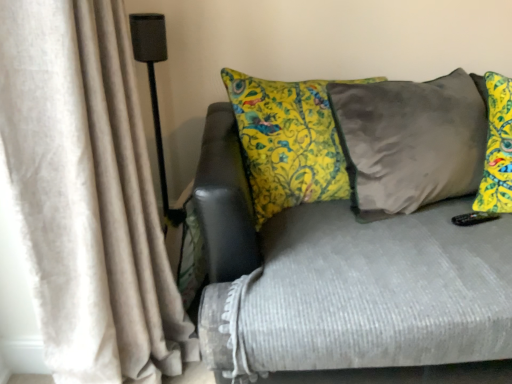
Question: Is beige velvet curtain at left closer to the viewer compared to textured gray couch at center?

Choices:
 (A) yes
 (B) no

Answer: (A)

Question: Is beige velvet curtain at left facing towards textured gray couch at center?

Choices:
 (A) yes
 (B) no

Answer: (A)

Question: Can you see beige velvet curtain at left touching textured gray couch at center?

Choices:
 (A) yes
 (B) no

Answer: (B)

Question: Can you confirm if beige velvet curtain at left is thinner than textured gray couch at center?

Choices:
 (A) yes
 (B) no

Answer: (A)

Question: From a real-world perspective, is beige velvet curtain at left below textured gray couch at center?

Choices:
 (A) yes
 (B) no

Answer: (B)

Question: Does beige velvet curtain at left appear on the left side of textured gray couch at center?

Choices:
 (A) yes
 (B) no

Answer: (A)

Question: Is black matte speaker at left taller than beige velvet curtain at left?

Choices:
 (A) no
 (B) yes

Answer: (A)

Question: Could you tell me if black matte speaker at left is facing beige velvet curtain at left?

Choices:
 (A) yes
 (B) no

Answer: (A)

Question: From a real-world perspective, is black matte speaker at left on beige velvet curtain at left?

Choices:
 (A) no
 (B) yes

Answer: (B)

Question: Is black matte speaker at left smaller than beige velvet curtain at left?

Choices:
 (A) yes
 (B) no

Answer: (A)

Question: Is black matte speaker at left bigger than beige velvet curtain at left?

Choices:
 (A) no
 (B) yes

Answer: (A)

Question: Is black matte speaker at left positioned in front of beige velvet curtain at left?

Choices:
 (A) no
 (B) yes

Answer: (A)

Question: Would you say textured gray couch at center is a long distance from beige velvet curtain at left?

Choices:
 (A) yes
 (B) no

Answer: (B)